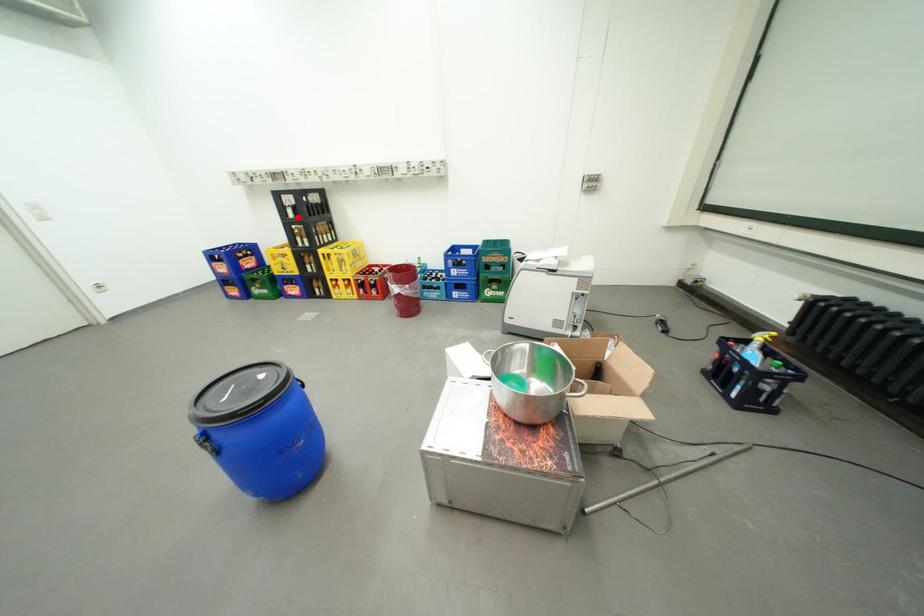
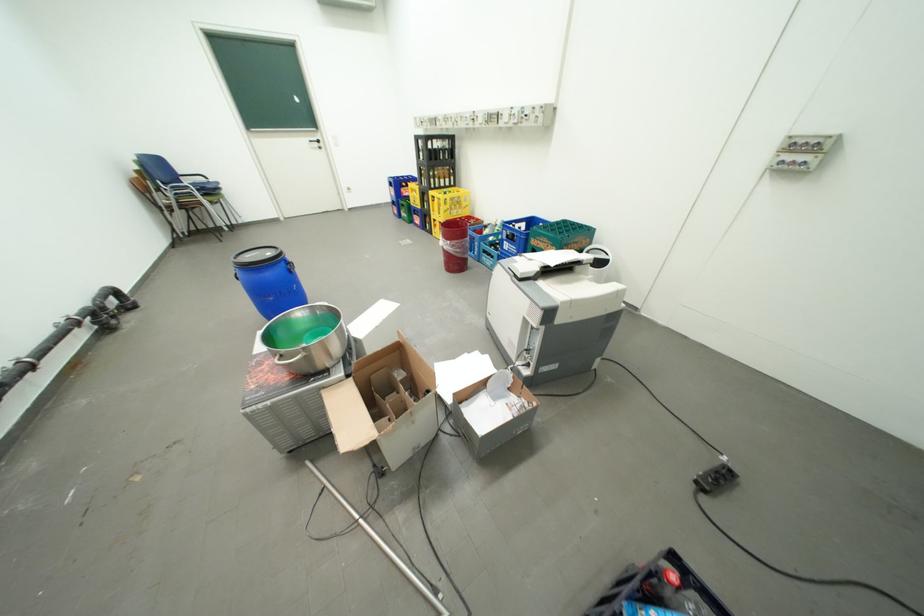
Question: I am providing you with two images of the same scene from different viewpoints. A red point is marked on the first image. Is the red point's position out of view in image 2?

Choices:
 (A) Yes
 (B) No

Answer: (B)